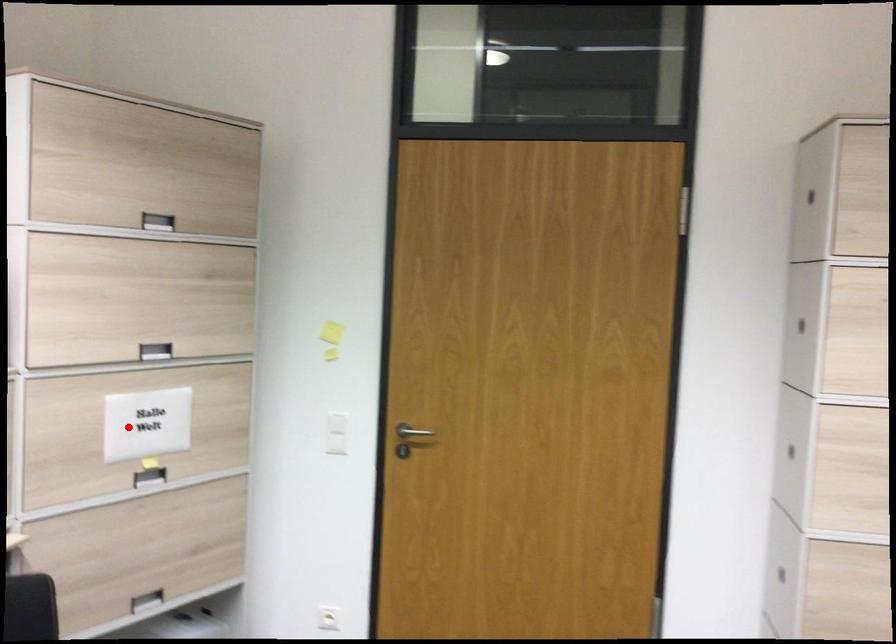
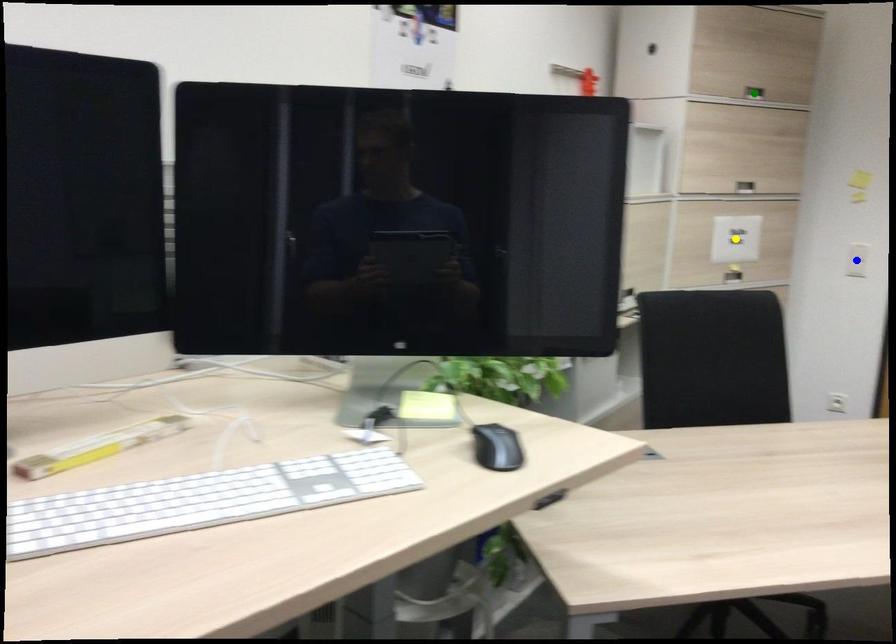
Question: I am providing you with two images of the same scene from different viewpoints. A red point is marked on the first image. You are given multiple points on the second image. Which point in image 2 represents the same 3d spot as the red point in image 1?

Choices:
 (A) green point
 (B) yellow point
 (C) blue point

Answer: (B)